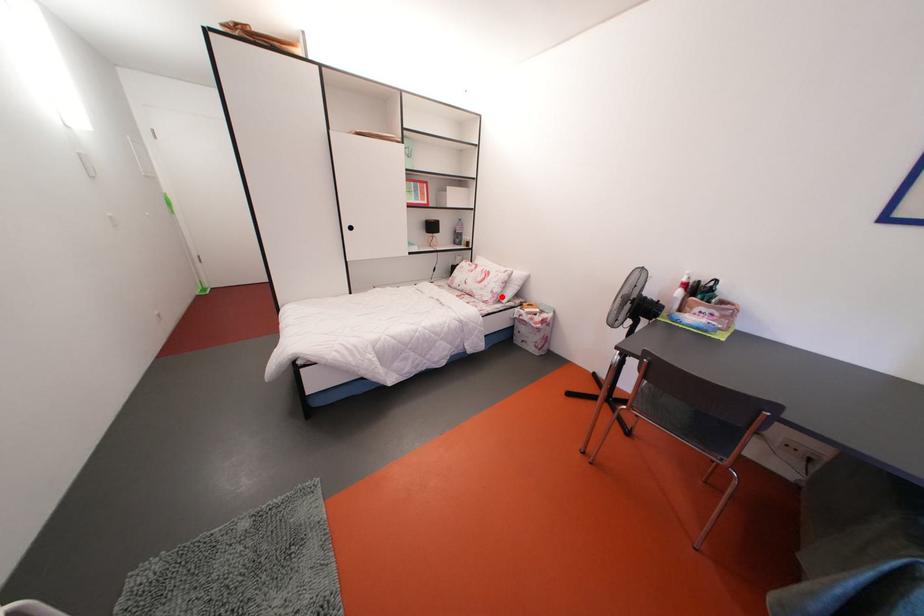
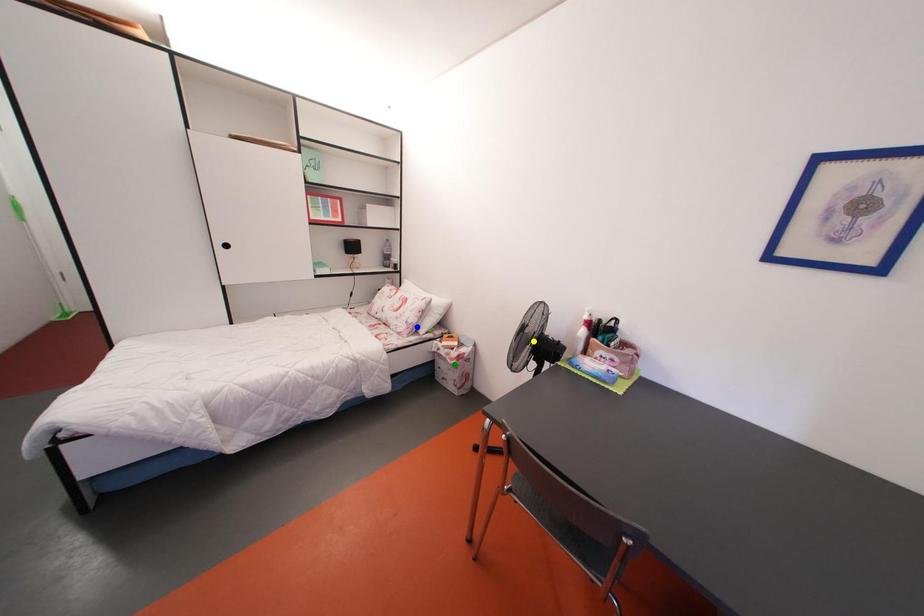
Question: I am providing you with two images of the same scene from different viewpoints. A red point is marked on the first image. You are given multiple points on the second image. Which point in image 2 is actually the same real-world point as the red point in image 1?

Choices:
 (A) blue point
 (B) green point
 (C) yellow point

Answer: (A)